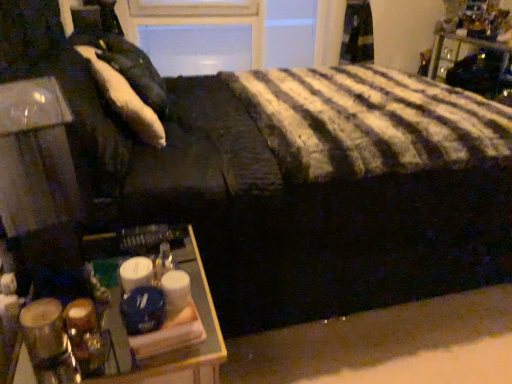
Question: From the image's perspective, is white soft pillow at upper left above wooden tray at lower left?

Choices:
 (A) yes
 (B) no

Answer: (A)

Question: Is the position of white soft pillow at upper left more distant than that of wooden tray at lower left?

Choices:
 (A) no
 (B) yes

Answer: (B)

Question: From the image's perspective, does white soft pillow at upper left appear lower than wooden tray at lower left?

Choices:
 (A) yes
 (B) no

Answer: (B)

Question: Considering the relative sizes of white soft pillow at upper left and wooden tray at lower left in the image provided, is white soft pillow at upper left smaller than wooden tray at lower left?

Choices:
 (A) no
 (B) yes

Answer: (B)

Question: Is white soft pillow at upper left to the right of wooden tray at lower left from the viewer's perspective?

Choices:
 (A) yes
 (B) no

Answer: (B)

Question: Is white soft pillow at upper left placed right next to wooden tray at lower left?

Choices:
 (A) yes
 (B) no

Answer: (B)

Question: Is wooden tray at lower left located outside white soft pillow at upper left?

Choices:
 (A) no
 (B) yes

Answer: (B)

Question: Is wooden tray at lower left further to camera compared to white soft pillow at upper left?

Choices:
 (A) yes
 (B) no

Answer: (B)

Question: Is wooden tray at lower left not close to white soft pillow at upper left?

Choices:
 (A) no
 (B) yes

Answer: (A)

Question: Is white soft pillow at upper left a part of wooden tray at lower left?

Choices:
 (A) no
 (B) yes

Answer: (A)

Question: From a real-world perspective, is wooden tray at lower left located higher than white soft pillow at upper left?

Choices:
 (A) no
 (B) yes

Answer: (A)

Question: Is wooden tray at lower left at the right side of white soft pillow at upper left?

Choices:
 (A) no
 (B) yes

Answer: (B)

Question: Is wooden tray at lower left at the left side of metallic black nightstand at upper right?

Choices:
 (A) no
 (B) yes

Answer: (B)